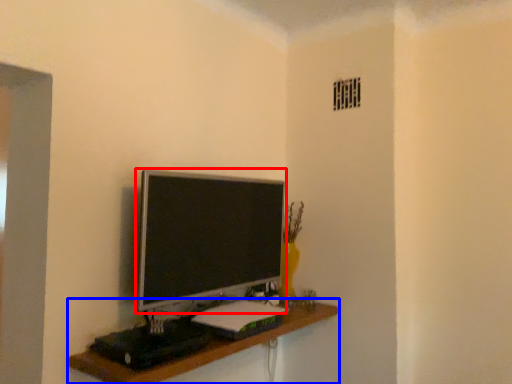
Question: Which of the following is the closest to the observer, television (highlighted by a red box) or shelf (highlighted by a blue box)?

Choices:
 (A) television
 (B) shelf

Answer: (B)